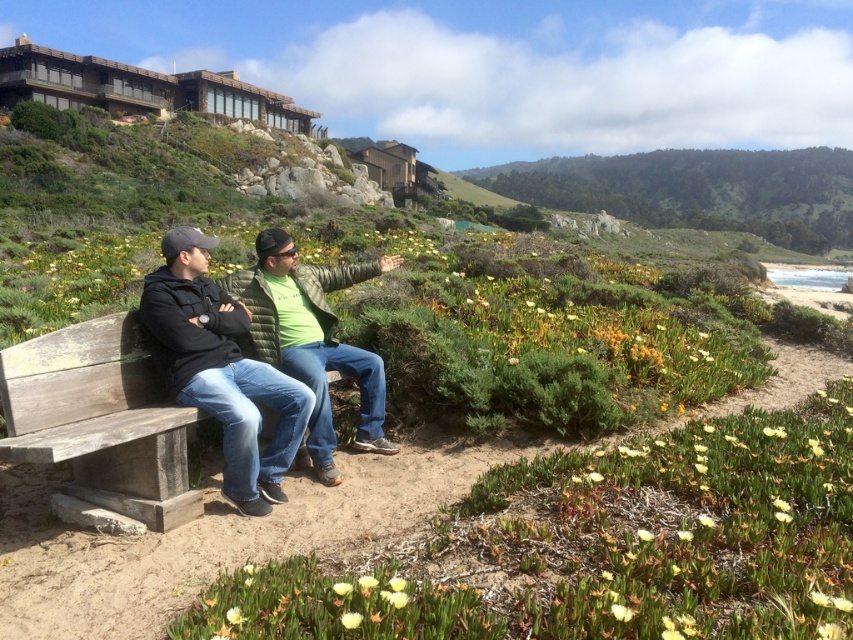
You are a photographer setting up a tripod to capture the coastal scene. You have a matte black jacket at center and a weathered wood bench at lower left in your frame. Which object should you adjust your camera angle to focus on if you want to highlight something taller in the scene?

The matte black jacket at center is taller than the weathered wood bench at lower left, so you should focus on the matte black jacket at center to highlight the taller object.

You are a photographer standing at the edge of the sandy path. You want to capture a photo of the weathered wood bench at lower left and the matte black jacket at center in the same frame. Given that your camera has a minimum focus distance of 45 centimeters, will both subjects be in focus?

The weathered wood bench at lower left and the matte black jacket at center are 46.05 centimeters apart. Since the distance between them is greater than the camera minimum focus distance of 45 centimeters, both subjects will be in focus.

You are standing at the entrance of the resort and see the weathered wood bench at lower left. Where is the bench positioned relative to the resort buildings?

The weathered wood bench at lower left is located at point (100, 419), which is to the left side of the resort buildings.